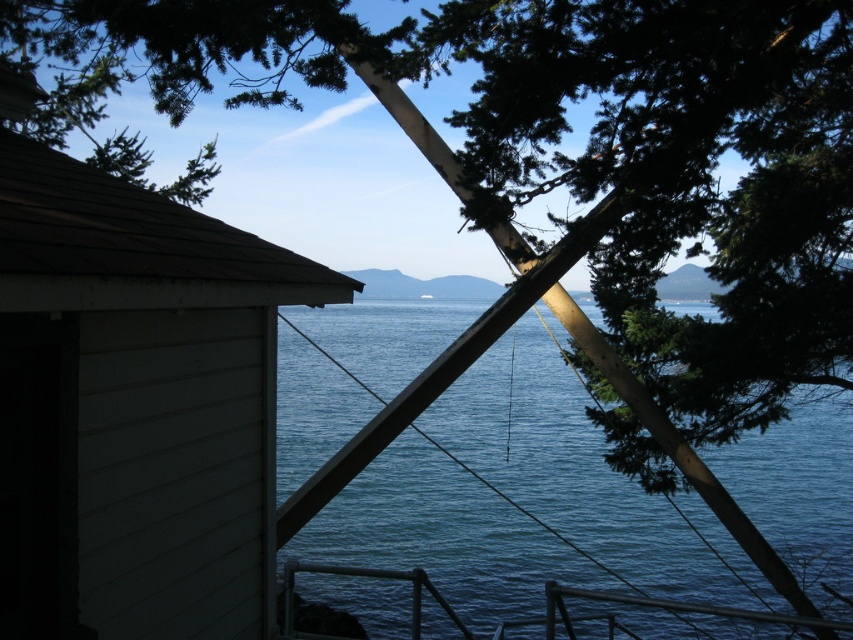
You are standing at the beach and see the white wood hut at left and the blue water at center. Which object is closer to your right side?

The blue water at center is closer to your right side because the white wood hut at left is to the left of it.